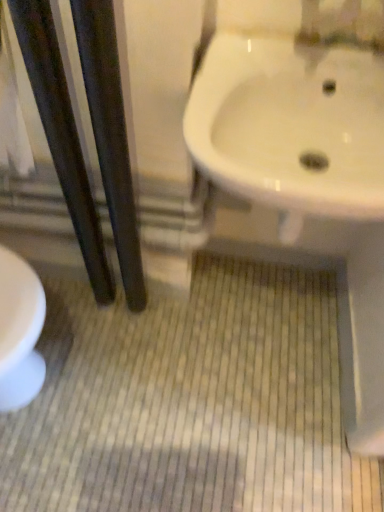
I want to click on vacant space that is to the left of dark wood pole at left, acting as the second pole starting from the right, so click(68, 310).